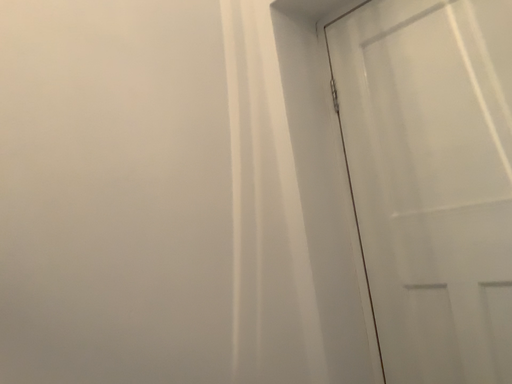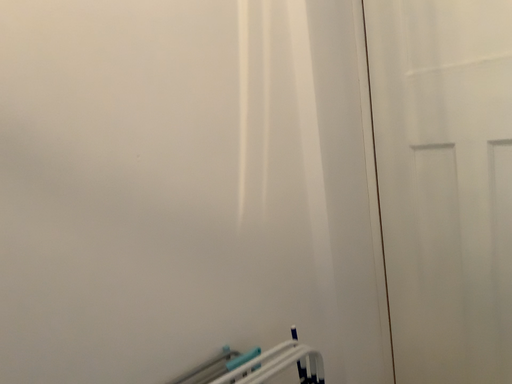
Question: Which way did the camera rotate in the video?

Choices:
 (A) rotated downward
 (B) rotated upward

Answer: (A)